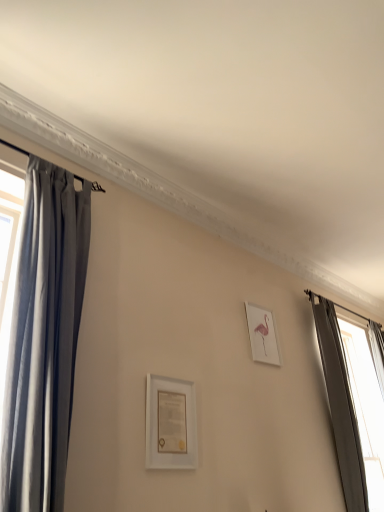
Image resolution: width=384 pixels, height=512 pixels. Find the location of `white matte picture frame at center, which appears as the 1th picture frame when viewed from the left`. white matte picture frame at center, which appears as the 1th picture frame when viewed from the left is located at coordinates (171, 425).

How much space does white matte picture frame at center, the 2th picture frame when ordered from back to front, occupy vertically?

17.09 inches.

The width and height of the screenshot is (384, 512). Identify the location of dark gray fabric curtain at right, acting as the 1th curtain starting from the right. (352, 406).

Considering the points (68, 197) and (371, 488), which point is in front, point (68, 197) or point (371, 488)?

Point (68, 197)

The image size is (384, 512). I want to click on curtain to the left of dark gray fabric curtain at right, the second curtain in the left-to-right sequence, so click(x=44, y=339).

From a real-world perspective, relative to dark gray fabric curtain at right, the first curtain positioned from the back, is silky gray curtain at left, the 1th curtain positioned from the left, vertically above or below?

From a real-world perspective, silky gray curtain at left, the 1th curtain positioned from the left, is physically above dark gray fabric curtain at right, the first curtain positioned from the back.

Can you confirm if white matte picture frame at center, which ranks as the 1th picture frame in front-to-back order, is positioned to the right of dark gray fabric curtain at right, the second curtain viewed from the front?

In fact, white matte picture frame at center, which ranks as the 1th picture frame in front-to-back order, is to the left of dark gray fabric curtain at right, the second curtain viewed from the front.

Considering the sizes of objects white matte picture frame at center, the 2th picture frame when ordered from back to front, and dark gray fabric curtain at right, the second curtain viewed from the front, in the image provided, who is smaller, white matte picture frame at center, the 2th picture frame when ordered from back to front, or dark gray fabric curtain at right, the second curtain viewed from the front,?

white matte picture frame at center, the 2th picture frame when ordered from back to front, is smaller.

Is white matte picture frame at center, the 2th picture frame when ordered from back to front, inside or outside of dark gray fabric curtain at right, the second curtain in the left-to-right sequence?

white matte picture frame at center, the 2th picture frame when ordered from back to front, is spatially situated outside dark gray fabric curtain at right, the second curtain in the left-to-right sequence.

From the image's perspective, which one is positioned lower, pink paper at upper right, which is the first picture frame in back-to-front order, or silky gray curtain at left, the second curtain from the right?

pink paper at upper right, which is the first picture frame in back-to-front order.

Is pink paper at upper right, the first picture frame in the right-to-left sequence, wider than silky gray curtain at left, which ranks as the first curtain in front-to-back order?

Incorrect, the width of pink paper at upper right, the first picture frame in the right-to-left sequence, does not surpass that of silky gray curtain at left, which ranks as the first curtain in front-to-back order.

Does point (262, 345) appear closer or farther from the camera than point (31, 429)?

Point (262, 345) is positioned farther from the camera compared to point (31, 429).

Is pink paper at upper right, which is the second picture frame from front to back, positioned beyond the bounds of silky gray curtain at left, the 1th curtain positioned from the left?

Indeed, pink paper at upper right, which is the second picture frame from front to back, is completely outside silky gray curtain at left, the 1th curtain positioned from the left.

Is white matte picture frame at center, the 2th picture frame when ordered from back to front, oriented towards pink paper at upper right, the first picture frame in the right-to-left sequence?

No, white matte picture frame at center, the 2th picture frame when ordered from back to front, is not oriented towards pink paper at upper right, the first picture frame in the right-to-left sequence.

In order to click on picture frame behind the white matte picture frame at center, placed as the second picture frame when sorted from right to left in this screenshot , I will do `click(262, 335)`.

Which is further, (170, 459) or (263, 320)?

The point (263, 320) is behind.

Is silky gray curtain at left, which ranks as the first curtain in front-to-back order, positioned with its back to white matte picture frame at center, which appears as the 1th picture frame when viewed from the left?

That's not correct — silky gray curtain at left, which ranks as the first curtain in front-to-back order, is not looking away from white matte picture frame at center, which appears as the 1th picture frame when viewed from the left.

What's the angular difference between silky gray curtain at left, the 1th curtain positioned from the left, and white matte picture frame at center, which appears as the 1th picture frame when viewed from the left,'s facing directions?

silky gray curtain at left, the 1th curtain positioned from the left, and white matte picture frame at center, which appears as the 1th picture frame when viewed from the left, are facing 8.02e-05 degrees away from each other.

In terms of height, does silky gray curtain at left, the 1th curtain positioned from the left, look taller or shorter compared to white matte picture frame at center, which appears as the 1th picture frame when viewed from the left?

silky gray curtain at left, the 1th curtain positioned from the left, is taller than white matte picture frame at center, which appears as the 1th picture frame when viewed from the left.

Looking at this image, from a real-world perspective, between silky gray curtain at left, positioned as the second curtain in back-to-front order, and white matte picture frame at center, the 2th picture frame when ordered from back to front, who is vertically lower?

In real-world perspective, white matte picture frame at center, the 2th picture frame when ordered from back to front, is lower.

How many degrees apart are the facing directions of pink paper at upper right, the first picture frame in the right-to-left sequence, and white matte picture frame at center, placed as the second picture frame when sorted from right to left?

The facing directions of pink paper at upper right, the first picture frame in the right-to-left sequence, and white matte picture frame at center, placed as the second picture frame when sorted from right to left, are 2.73e-05 degrees apart.

Does pink paper at upper right, the first picture frame in the right-to-left sequence, appear on the left side of white matte picture frame at center, placed as the second picture frame when sorted from right to left?

No.

From the image's perspective, is pink paper at upper right, the first picture frame in the right-to-left sequence, under white matte picture frame at center, which appears as the 1th picture frame when viewed from the left?

No, from the image's perspective, pink paper at upper right, the first picture frame in the right-to-left sequence, is not below white matte picture frame at center, which appears as the 1th picture frame when viewed from the left.

Considering the relative positions of pink paper at upper right, which is the first picture frame in back-to-front order, and white matte picture frame at center, which appears as the 1th picture frame when viewed from the left, in the image provided, is pink paper at upper right, which is the first picture frame in back-to-front order, in front of white matte picture frame at center, which appears as the 1th picture frame when viewed from the left,?

No, pink paper at upper right, which is the first picture frame in back-to-front order, is behind white matte picture frame at center, which appears as the 1th picture frame when viewed from the left.

From a real-world perspective, which is physically below, white matte picture frame at center, which ranks as the 1th picture frame in front-to-back order, or silky gray curtain at left, the second curtain from the right?

white matte picture frame at center, which ranks as the 1th picture frame in front-to-back order, from a real-world perspective.

I want to click on curtain that is the 2nd object above the white matte picture frame at center, which ranks as the 1th picture frame in front-to-back order (from a real-world perspective), so [x=44, y=339].

From their relative heights in the image, would you say white matte picture frame at center, the 2th picture frame when ordered from back to front, is taller or shorter than silky gray curtain at left, which ranks as the first curtain in front-to-back order?

In the image, white matte picture frame at center, the 2th picture frame when ordered from back to front, appears to be shorter than silky gray curtain at left, which ranks as the first curtain in front-to-back order.

Between point (157, 405) and point (46, 314), which one is positioned in front?

The point (46, 314) is closer to the camera.

The width and height of the screenshot is (384, 512). Identify the location of curtain below the silky gray curtain at left, the 1th curtain positioned from the left (from the image's perspective). (352, 406).

From a real-world perspective, starting from the white matte picture frame at center, which ranks as the 1th picture frame in front-to-back order, which curtain is the 1st one vertically above it? Please provide its 2D coordinates.

[(352, 406)]

Considering their positions, is dark gray fabric curtain at right, the second curtain in the left-to-right sequence, positioned closer to silky gray curtain at left, the 1th curtain positioned from the left, than pink paper at upper right, which is the second picture frame from front to back?

Among the two, pink paper at upper right, which is the second picture frame from front to back, is located nearer to silky gray curtain at left, the 1th curtain positioned from the left.

Based on their spatial positions, is dark gray fabric curtain at right, the second curtain in the left-to-right sequence, or silky gray curtain at left, the 1th curtain positioned from the left, further from pink paper at upper right, which is the first picture frame in back-to-front order?

The object further to pink paper at upper right, which is the first picture frame in back-to-front order, is dark gray fabric curtain at right, the second curtain in the left-to-right sequence.

In the scene shown: When comparing their distances from pink paper at upper right, the first picture frame in the right-to-left sequence, does white matte picture frame at center, which ranks as the 1th picture frame in front-to-back order, or silky gray curtain at left, positioned as the second curtain in back-to-front order, seem closer?

The object closer to pink paper at upper right, the first picture frame in the right-to-left sequence, is white matte picture frame at center, which ranks as the 1th picture frame in front-to-back order.

Estimate the real-world distances between objects in this image. Which object is closer to white matte picture frame at center, placed as the second picture frame when sorted from right to left, silky gray curtain at left, the 1th curtain positioned from the left, or dark gray fabric curtain at right, the second curtain in the left-to-right sequence?

silky gray curtain at left, the 1th curtain positioned from the left, is closer to white matte picture frame at center, placed as the second picture frame when sorted from right to left.

Based on their spatial positions, is white matte picture frame at center, which appears as the 1th picture frame when viewed from the left, or pink paper at upper right, the first picture frame in the right-to-left sequence, closer to silky gray curtain at left, the second curtain from the right?

Among the two, white matte picture frame at center, which appears as the 1th picture frame when viewed from the left, is located nearer to silky gray curtain at left, the second curtain from the right.

When comparing their distances from white matte picture frame at center, which appears as the 1th picture frame when viewed from the left, does pink paper at upper right, which is the second picture frame from front to back, or dark gray fabric curtain at right, the second curtain in the left-to-right sequence, seem further?

dark gray fabric curtain at right, the second curtain in the left-to-right sequence, is further to white matte picture frame at center, which appears as the 1th picture frame when viewed from the left.

Based on their spatial positions, is silky gray curtain at left, positioned as the second curtain in back-to-front order, or dark gray fabric curtain at right, the second curtain viewed from the front, further from pink paper at upper right, the first picture frame in the right-to-left sequence?

dark gray fabric curtain at right, the second curtain viewed from the front, is positioned further to the anchor pink paper at upper right, the first picture frame in the right-to-left sequence.

Estimate the real-world distances between objects in this image. Which object is further from pink paper at upper right, the first picture frame in the right-to-left sequence, silky gray curtain at left, the second curtain from the right, or white matte picture frame at center, which appears as the 1th picture frame when viewed from the left?

Based on the image, silky gray curtain at left, the second curtain from the right, appears to be further to pink paper at upper right, the first picture frame in the right-to-left sequence.

The height and width of the screenshot is (512, 384). I want to click on curtain positioned between silky gray curtain at left, which ranks as the first curtain in front-to-back order, and pink paper at upper right, which is the first picture frame in back-to-front order, from near to far, so click(x=352, y=406).

What are the coordinates of `picture frame situated between white matte picture frame at center, which appears as the 1th picture frame when viewed from the left, and dark gray fabric curtain at right, the first curtain positioned from the back, from left to right` in the screenshot? It's located at (262, 335).

In order to click on picture frame between silky gray curtain at left, the 1th curtain positioned from the left, and pink paper at upper right, which ranks as the second picture frame in left-to-right order, in the front-back direction in this screenshot , I will do `click(171, 425)`.